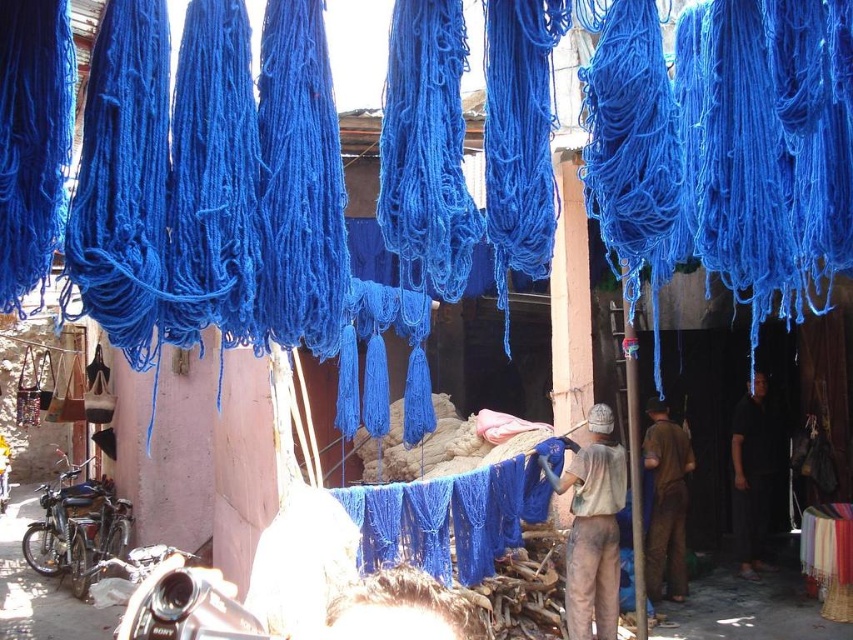
Looking at this image, you are an assistant helping to organize materials in a dyeing workshop. You see the black cotton shirt at center and the brown fabric at center. Which item is positioned higher up in the scene?

The black cotton shirt at center is located above the brown fabric at center, so it is positioned higher up in the scene.

You are a worker in the dyeing workshop and need to move a heavy bucket from your current position near the dirty beige shirt at center to the black cotton shirt at center. Given that the path between them is clear, can you safely carry the bucket without spilling it?

The dirty beige shirt at center and black cotton shirt at center are 3.16 meters apart. Since the path is clear, you can safely carry the bucket the 3.16 meters to the black cotton shirt at center without spilling it.

You are a tailor trying to decide which fabric to use for a new dress pattern. Given the black cotton shirt at center and the brown fabric at center, which one has a greater width to accommodate the design?

The black cotton shirt at center might be wider than brown fabric at center, so it could be the better choice for the dress pattern requiring more width.